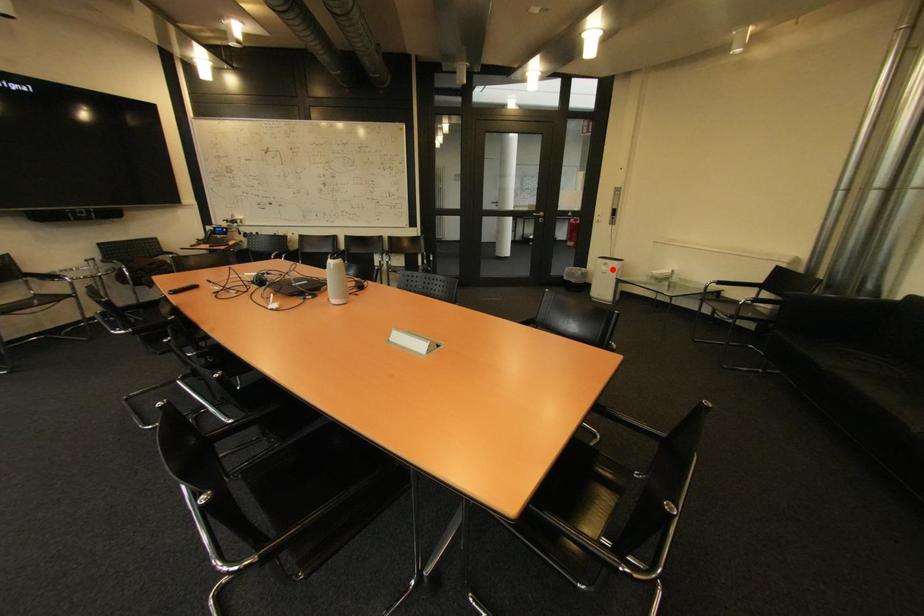
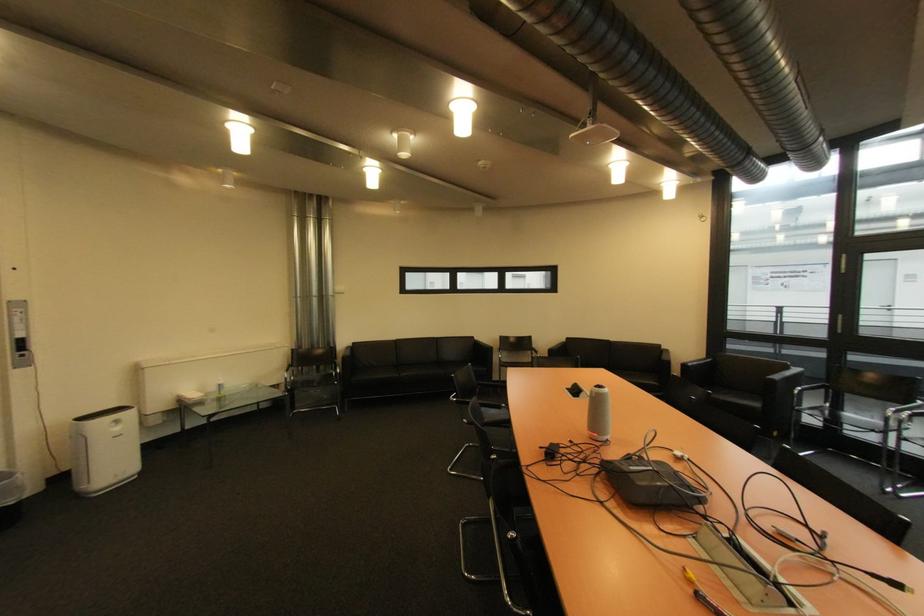
Question: A red point is marked in image1. In image2, is the corresponding 3D point closer to the camera or farther? Reply with the corresponding letter.

Choices:
 (A) The corresponding 3D point is closer.
 (B) The corresponding 3D point is farther.

Answer: (B)